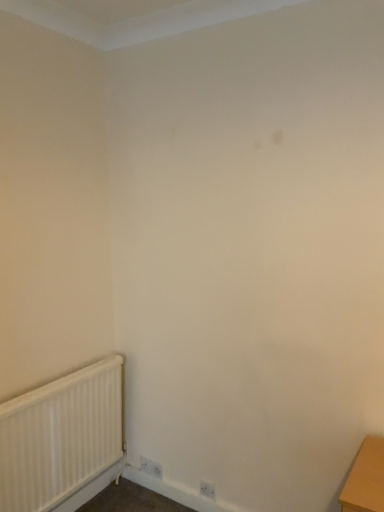
Image resolution: width=384 pixels, height=512 pixels. What do you see at coordinates (150, 467) in the screenshot? I see `white plastic electric outlet at lower center` at bounding box center [150, 467].

In order to face white plastic electric outlet at lower center, should I rotate leftwards or rightwards?

Rotate your view left by about 5.441°.

Find the location of a particular element. white plastic electric outlet at lower center is located at coordinates (150, 467).

This screenshot has height=512, width=384. In order to click on white plastic radiator at lower left in this screenshot , I will do `click(60, 436)`.

Measure the distance between point (81, 413) and camera.

6.95 feet.

What do you see at coordinates (60, 436) in the screenshot? I see `white plastic radiator at lower left` at bounding box center [60, 436].

Where is `white plastic electric outlet at lower center`? The height and width of the screenshot is (512, 384). white plastic electric outlet at lower center is located at coordinates (150, 467).

Is white plastic radiator at lower left to the left of white plastic electric outlet at lower center from the viewer's perspective?

Yes.

Which object is more forward, white plastic radiator at lower left or white plastic electric outlet at lower center?

white plastic radiator at lower left is in front.

Between point (110, 444) and point (155, 462), which one is positioned behind?

The point (155, 462) is behind.

From the image's perspective, which object appears higher, white plastic radiator at lower left or white plastic electric outlet at lower center?

From the image's view, white plastic radiator at lower left is above.

From a real-world perspective, is white plastic radiator at lower left over white plastic electric outlet at lower center?

Correct, in the physical world, white plastic radiator at lower left is higher than white plastic electric outlet at lower center.

Looking at this image, in terms of width, does white plastic radiator at lower left look wider or thinner when compared to white plastic electric outlet at lower center?

white plastic radiator at lower left is wider than white plastic electric outlet at lower center.

In terms of height, does white plastic radiator at lower left look taller or shorter compared to white plastic electric outlet at lower center?

In the image, white plastic radiator at lower left appears to be taller than white plastic electric outlet at lower center.

Between white plastic radiator at lower left and white plastic electric outlet at lower center, which one has larger size?

white plastic radiator at lower left is bigger.

Can white plastic electric outlet at lower center be found inside white plastic radiator at lower left?

No, white plastic radiator at lower left does not contain white plastic electric outlet at lower center.

Are white plastic radiator at lower left and white plastic electric outlet at lower center beside each other?

white plastic radiator at lower left and white plastic electric outlet at lower center are clearly separated.

Is white plastic radiator at lower left facing towards white plastic electric outlet at lower center?

No, white plastic radiator at lower left does not turn towards white plastic electric outlet at lower center.

Could you measure the distance between white plastic radiator at lower left and white plastic electric outlet at lower center?

white plastic radiator at lower left is 56.29 centimeters from white plastic electric outlet at lower center.

I want to click on radiator above the white plastic electric outlet at lower center (from a real-world perspective), so click(60, 436).

Is white plastic electric outlet at lower center at the right side of white plastic radiator at lower left?

Correct, you'll find white plastic electric outlet at lower center to the right of white plastic radiator at lower left.

Is the depth of white plastic electric outlet at lower center greater than that of white plastic radiator at lower left?

Yes, white plastic electric outlet at lower center is further from the viewer.

Is point (147, 465) closer to viewer compared to point (114, 426)?

That is False.

From the image's perspective, is white plastic electric outlet at lower center above white plastic radiator at lower left?

Actually, white plastic electric outlet at lower center appears below white plastic radiator at lower left in the image.

From a real-world perspective, which object rests below the other?

In real-world perspective, white plastic electric outlet at lower center is lower.

Looking at their sizes, would you say white plastic electric outlet at lower center is wider or thinner than white plastic radiator at lower left?

Considering their sizes, white plastic electric outlet at lower center looks slimmer than white plastic radiator at lower left.

Which of these two, white plastic electric outlet at lower center or white plastic radiator at lower left, stands shorter?

white plastic electric outlet at lower center.

Who is bigger, white plastic electric outlet at lower center or white plastic radiator at lower left?

Bigger between the two is white plastic radiator at lower left.

Is white plastic electric outlet at lower center located outside white plastic radiator at lower left?

Yes, white plastic electric outlet at lower center is outside of white plastic radiator at lower left.

Is white plastic electric outlet at lower center touching white plastic radiator at lower left?

There is a gap between white plastic electric outlet at lower center and white plastic radiator at lower left.

Is white plastic electric outlet at lower center facing away from white plastic radiator at lower left?

No, white plastic electric outlet at lower center is not facing away from white plastic radiator at lower left.

How different are the orientations of white plastic electric outlet at lower center and white plastic radiator at lower left in degrees?

The angular difference between white plastic electric outlet at lower center and white plastic radiator at lower left is 89.8 degrees.

There is a white plastic electric outlet at lower center. Where is `radiator above it (from a real-world perspective)`? The image size is (384, 512). radiator above it (from a real-world perspective) is located at coordinates (60, 436).

This screenshot has height=512, width=384. I want to click on radiator on the left of white plastic electric outlet at lower center, so click(x=60, y=436).

The width and height of the screenshot is (384, 512). I want to click on electric outlet on the right of white plastic radiator at lower left, so click(x=150, y=467).